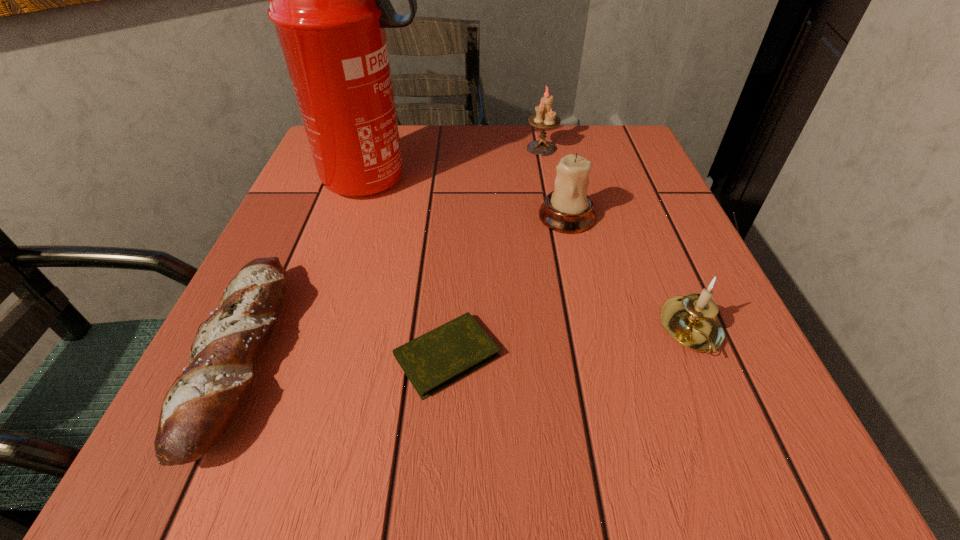
Where is `vacant space located on the handle side of the nearest candle holder`? This screenshot has height=540, width=960. vacant space located on the handle side of the nearest candle holder is located at coordinates (743, 451).

This screenshot has height=540, width=960. I want to click on vacant space located 0.250m on the right of the baguet, so click(450, 356).

The height and width of the screenshot is (540, 960). I want to click on free space located 0.050m on the back of the shortest object, so click(450, 293).

Locate an element on the screen. Image resolution: width=960 pixels, height=540 pixels. fire extinguisher at the far edge is located at coordinates (329, 0).

The image size is (960, 540). Find the location of `candle holder that is at the far edge`. candle holder that is at the far edge is located at coordinates (545, 118).

Locate an element on the screen. The image size is (960, 540). object positioned at the near edge is located at coordinates (200, 405).

You are a GUI agent. You are given a task and a screenshot of the screen. Output one action in this format:
    pyautogui.click(x=<x>, y=<y>)
    Task: Click on the fire extinguisher that is at the left edge
    The width and height of the screenshot is (960, 540).
    Given the screenshot: What is the action you would take?
    pyautogui.click(x=329, y=0)

Locate an element on the screen. baguet situated at the left edge is located at coordinates (200, 405).

Locate an element on the screen. Image resolution: width=960 pixels, height=540 pixels. object that is at the far left corner is located at coordinates (329, 0).

The width and height of the screenshot is (960, 540). I want to click on object at the near left corner, so click(x=200, y=405).